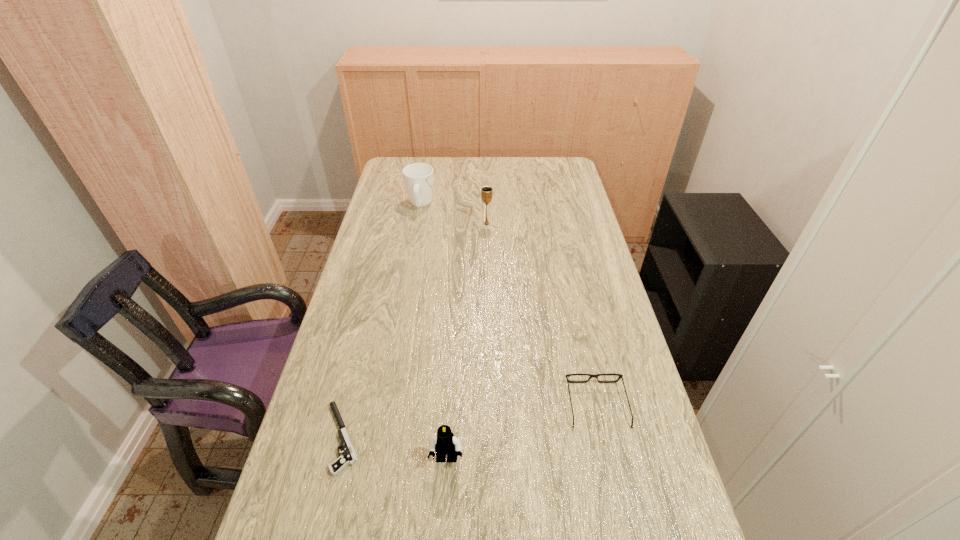
The height and width of the screenshot is (540, 960). Identify the location of free space located on the side of the mug with the handle. 427,165.

Identify the location of vacant space located on the side of the mug with the handle. Image resolution: width=960 pixels, height=540 pixels. (424, 184).

Image resolution: width=960 pixels, height=540 pixels. Find the location of `free space located on the front-facing side of the third tallest object`. free space located on the front-facing side of the third tallest object is located at coordinates (444, 497).

Find the location of a particular element. vacant space positioned on the front-facing side of the spectacles is located at coordinates (x=575, y=307).

Identify the location of vacant space located 0.400m on the front-facing side of the spectacles. The width and height of the screenshot is (960, 540). (569, 279).

Identify the location of free space located 0.370m on the front-facing side of the spectacles. This screenshot has height=540, width=960. (570, 285).

Find the location of a particular element. mug situated at the left edge is located at coordinates (418, 177).

Find the location of a particular element. The width and height of the screenshot is (960, 540). pistol present at the left edge is located at coordinates (349, 457).

Where is `object that is at the right edge`? This screenshot has height=540, width=960. object that is at the right edge is located at coordinates (608, 374).

The height and width of the screenshot is (540, 960). In the image, there is a desktop. Identify the location of vacant space at the far edge. (521, 178).